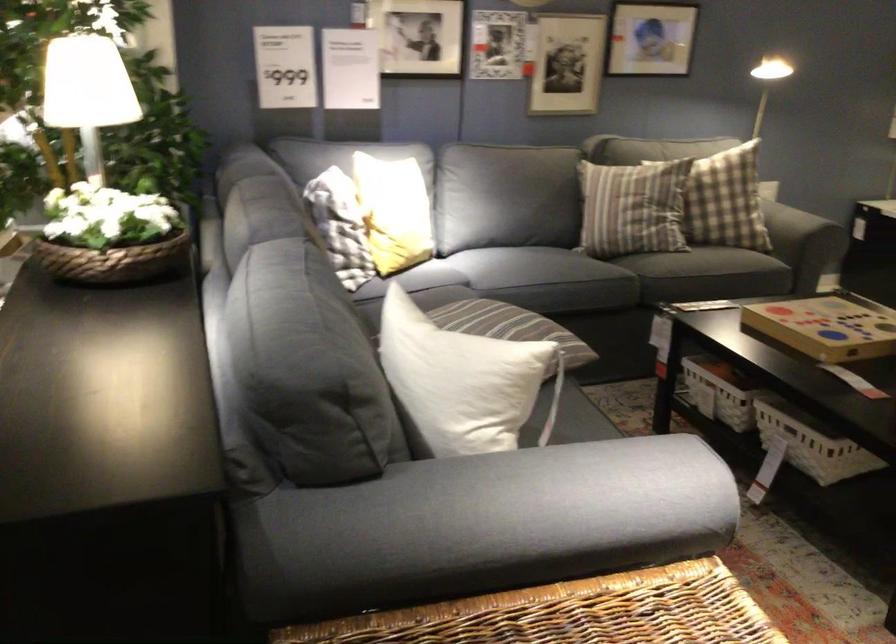
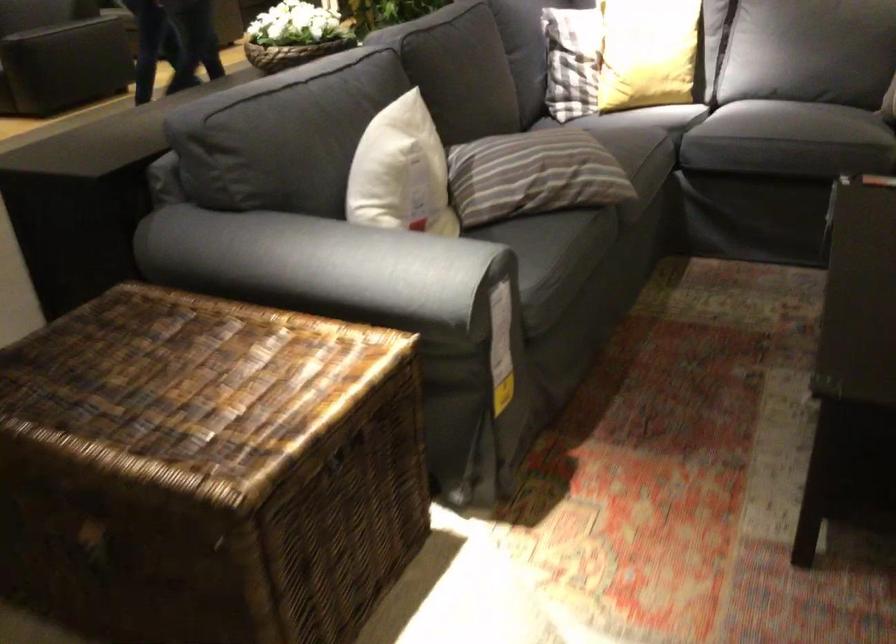
Question: I am providing you with two images of the same scene from different viewpoints. Please identify which objects are invisible in image2.

Choices:
 (A) woven flower basket
 (B) striped pillow
 (C) yellow pillow
 (D) none of these

Answer: (D)